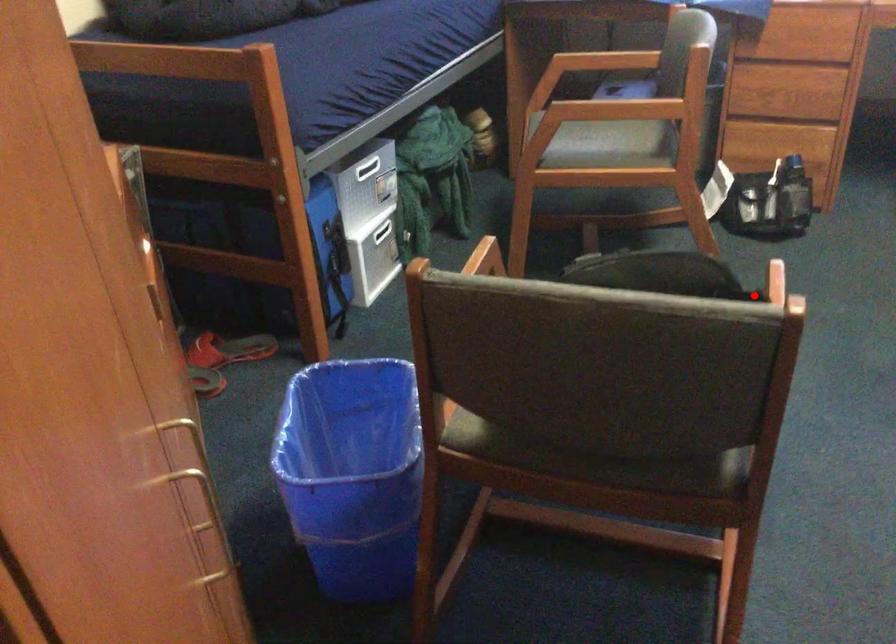
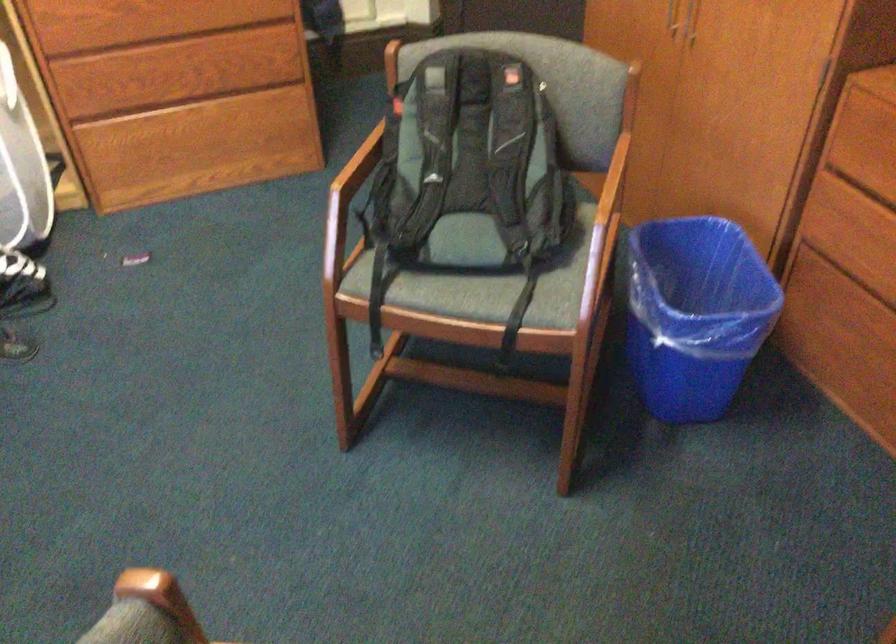
Question: I am providing you with two images of the same scene from different viewpoints. Given a red point in image1, look at the same physical point in image2. Is it:

Choices:
 (A) Closer to the viewpoint
 (B) Farther from the viewpoint

Answer: (B)